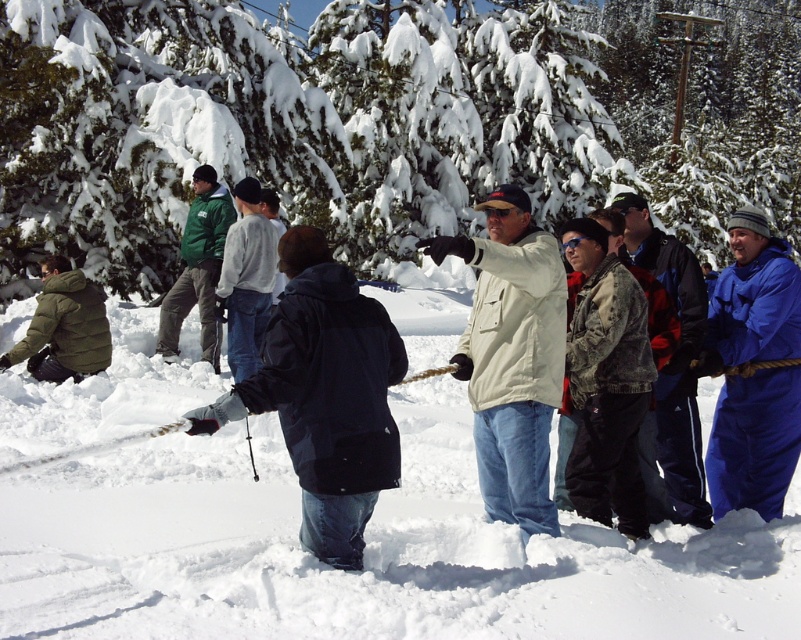
Who is shorter, dark blue jacket at center or white plastic ski at center?

Standing shorter between the two is white plastic ski at center.

Is point (337, 486) farther from viewer compared to point (184, 428)?

Yes.

Does point (296, 284) come behind point (17, 465)?

No, it is in front of (17, 465).

The height and width of the screenshot is (640, 801). What are the coordinates of `dark blue jacket at center` in the screenshot? It's located at (324, 396).

Between point (300, 134) and point (91, 333), which one is positioned behind?

The point (300, 134) is more distant.

Which is above, snow-covered evergreen tree at center or green down jacket at lower left?

snow-covered evergreen tree at center is higher up.

Which is behind, point (584, 90) or point (50, 348)?

Point (584, 90)

Find the location of a particular element. This screenshot has width=801, height=640. snow-covered evergreen tree at center is located at coordinates (381, 122).

Can you confirm if dark blue jacket at center is bigger than beige fabric jacket at center?

Incorrect, dark blue jacket at center is not larger than beige fabric jacket at center.

Image resolution: width=801 pixels, height=640 pixels. What do you see at coordinates (324, 396) in the screenshot? I see `dark blue jacket at center` at bounding box center [324, 396].

The image size is (801, 640). What do you see at coordinates (324, 396) in the screenshot?
I see `dark blue jacket at center` at bounding box center [324, 396].

Where is `dark blue jacket at center`? This screenshot has height=640, width=801. dark blue jacket at center is located at coordinates (324, 396).